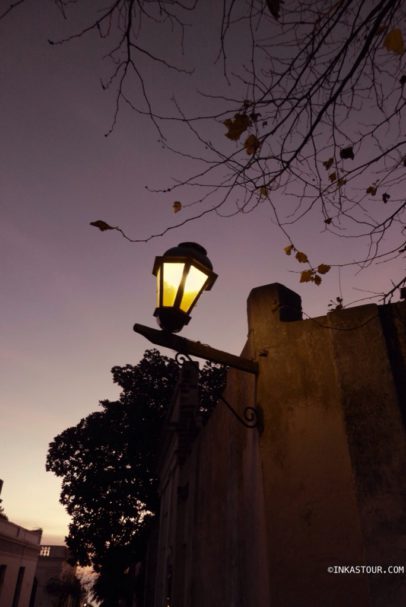
Locate an element on the screen. Image resolution: width=406 pixels, height=607 pixels. base of lamp is located at coordinates (166, 328).